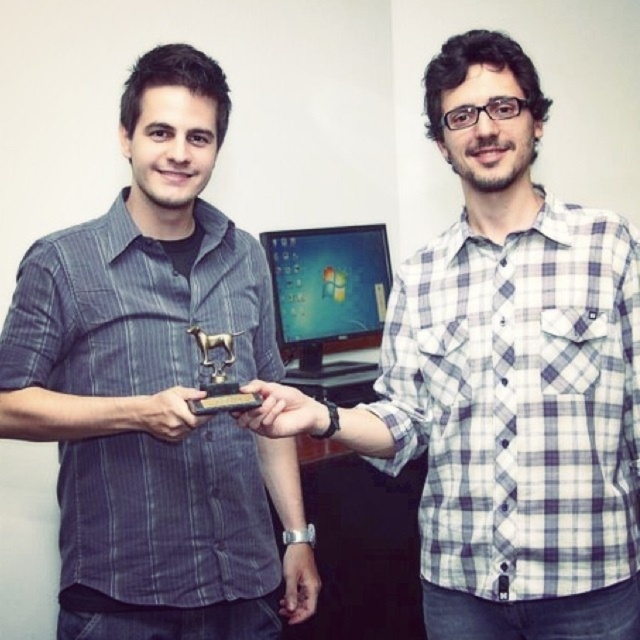
Is point (580, 216) positioned in front of point (282, 422)?

No, (580, 216) is behind (282, 422).

Is white checkered shirt at center to the right of matte black trophy at center from the viewer's perspective?

Yes, white checkered shirt at center is to the right of matte black trophy at center.

This screenshot has width=640, height=640. I want to click on white checkered shirt at center, so pyautogui.click(x=513, y=378).

Who is taller, matte plastic monitor at center or matte black trophy at center?

Standing taller between the two is matte plastic monitor at center.

Is point (369, 262) farther from viewer compared to point (275, 401)?

Yes, it is behind point (275, 401).

At what (x,y) coordinates should I click in order to perform the action: click on matte plastic monitor at center. Please return your answer as a coordinate pair (x, y). The width and height of the screenshot is (640, 640). Looking at the image, I should click on (326, 292).

The height and width of the screenshot is (640, 640). Find the location of `matte plastic monitor at center`. matte plastic monitor at center is located at coordinates (326, 292).

Can you confirm if matte plastic monitor at center is positioned to the left of matte black phone at center?

In fact, matte plastic monitor at center is to the right of matte black phone at center.

Between matte plastic monitor at center and matte black phone at center, which one is positioned lower?

matte black phone at center is lower down.

Does point (330, 324) lie behind point (170, 396)?

Yes, it is.

The height and width of the screenshot is (640, 640). Find the location of `matte plastic monitor at center`. matte plastic monitor at center is located at coordinates (326, 292).